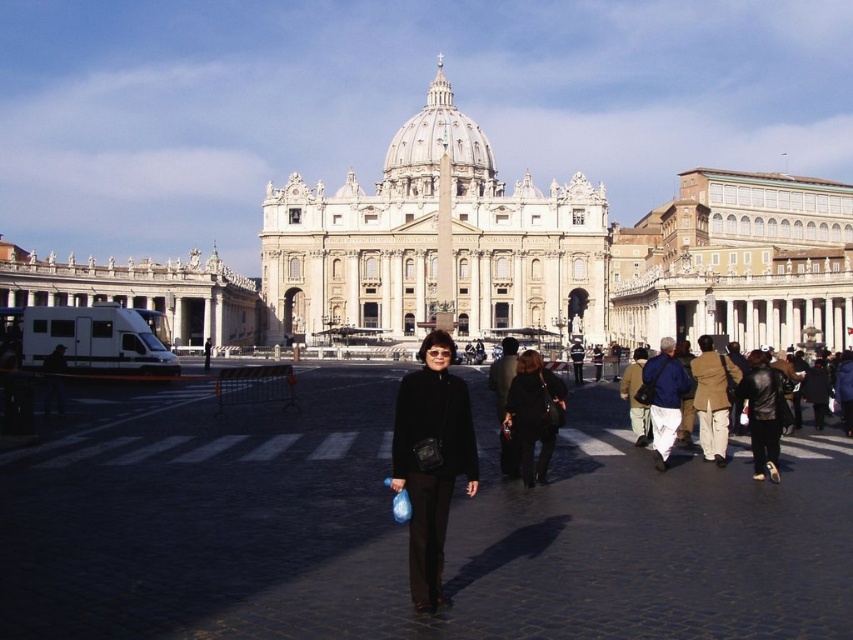
Question: In this image, where is white marble palace at left located relative to black matte jacket at center?

Choices:
 (A) below
 (B) above

Answer: (B)

Question: Which of the following is the farthest from the observer?

Choices:
 (A) white marble cathedral at center
 (B) black asphalt at center
 (C) white marble palace at left

Answer: (A)

Question: Is white marble palace at right smaller than blue fabric bag at center?

Choices:
 (A) yes
 (B) no

Answer: (B)

Question: Considering the real-world distances, which object is closest to the black leather jacket at center?

Choices:
 (A) white marble cathedral at center
 (B) blue fabric bag at center
 (C) white marble palace at left
 (D) black matte jacket at center

Answer: (D)

Question: Observing the image, what is the correct spatial positioning of white marble palace at left in reference to black matte jacket at center?

Choices:
 (A) left
 (B) right

Answer: (A)

Question: Among these points, which one is nearest to the camera?

Choices:
 (A) (451, 477)
 (B) (820, 212)

Answer: (A)